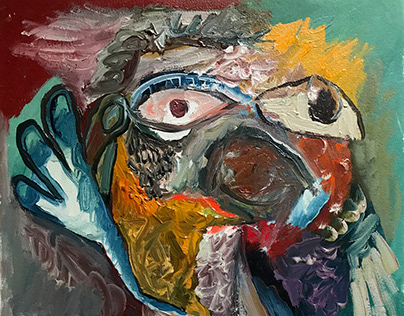
I want to click on paitning, so click(316, 139).